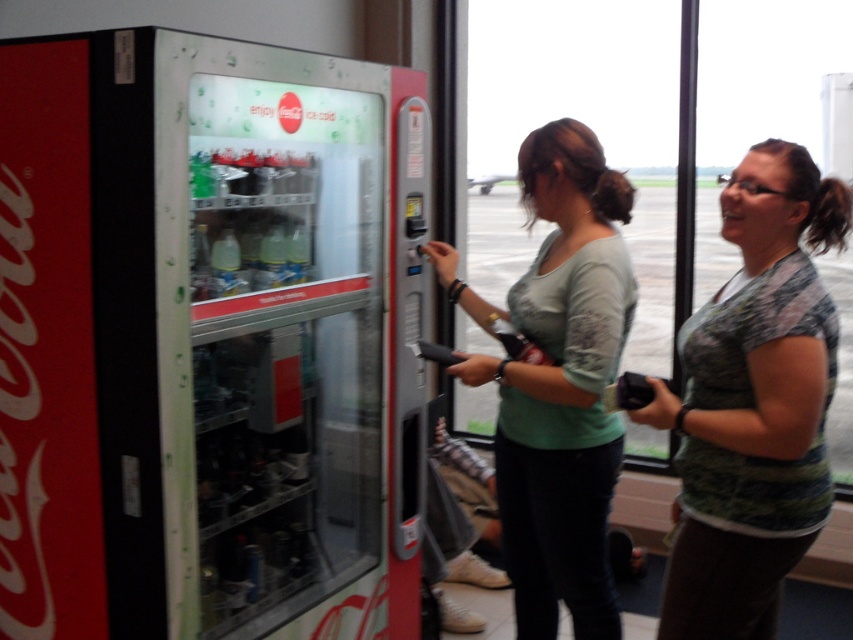
Question: Which object is positioned closest to the metallic silver vending machine at left?

Choices:
 (A) camouflage shirt at center
 (B) light green fabric shirt at center

Answer: (B)

Question: Which of these objects is positioned closest to the metallic silver vending machine at left?

Choices:
 (A) camouflage shirt at center
 (B) light green fabric shirt at center

Answer: (B)

Question: Where is camouflage shirt at center located in relation to light green fabric shirt at center in the image?

Choices:
 (A) above
 (B) below

Answer: (A)

Question: Does camouflage shirt at center appear under light green fabric shirt at center?

Choices:
 (A) no
 (B) yes

Answer: (A)

Question: Can you confirm if metallic silver vending machine at left is positioned below light green fabric shirt at center?

Choices:
 (A) yes
 (B) no

Answer: (B)

Question: Which point is farther from the camera taking this photo?

Choices:
 (A) (821, 362)
 (B) (163, 528)

Answer: (B)